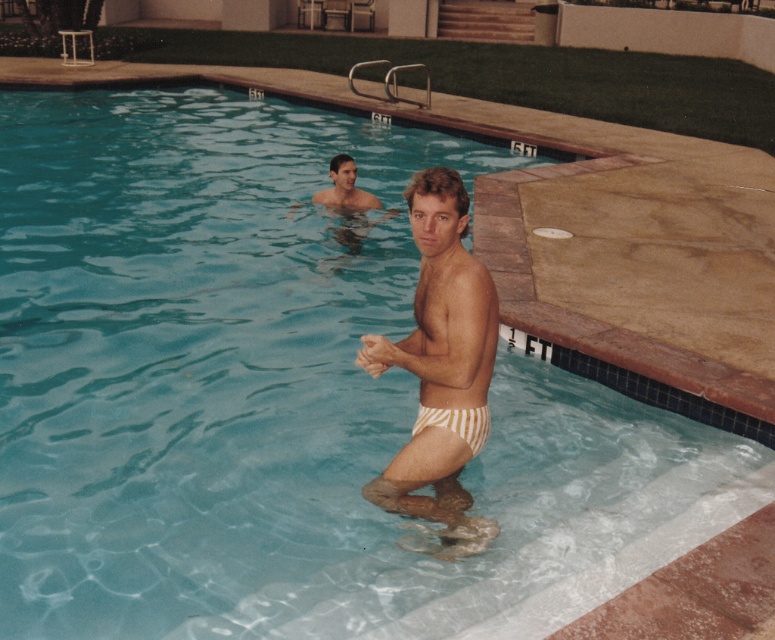
Is point (443, 420) positioned before point (436, 412)?

Yes, it is in front of point (436, 412).

Between point (450, 480) and point (488, 416), which one is positioned behind?

Positioned behind is point (450, 480).

Find the location of a particular element. The image size is (775, 640). white striped swimsuit at center is located at coordinates (441, 368).